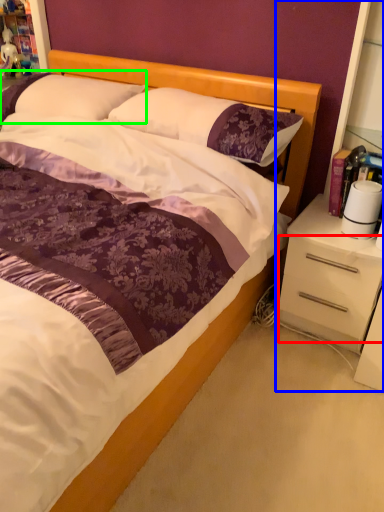
Question: Which object is the closest to the drawer (highlighted by a red box)? Choose among these: dresser (highlighted by a blue box) or pillow (highlighted by a green box).

Choices:
 (A) dresser
 (B) pillow

Answer: (A)